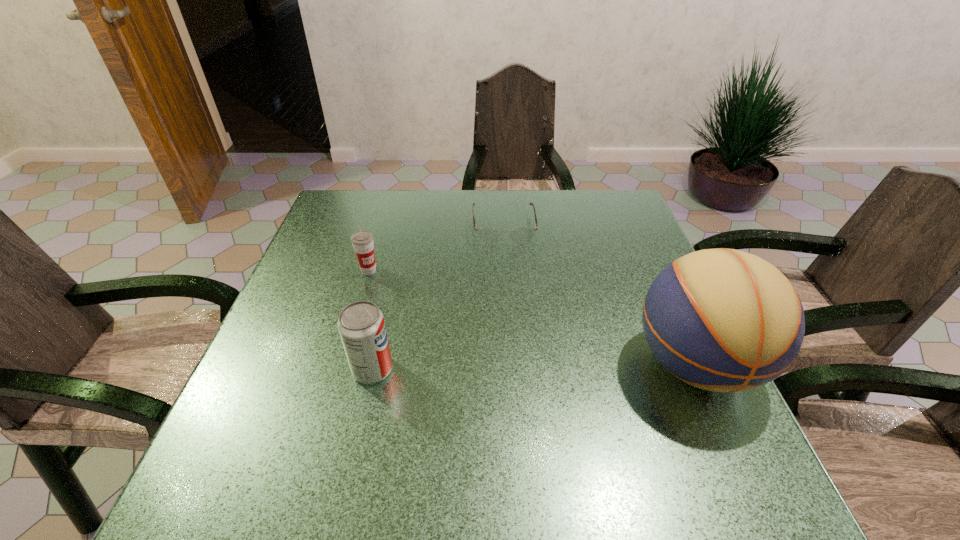
Where is `vacant space at the left edge of the desktop`? The image size is (960, 540). vacant space at the left edge of the desktop is located at coordinates (324, 269).

In the image, there is a desktop. Where is `vacant space at the right edge`? This screenshot has height=540, width=960. vacant space at the right edge is located at coordinates (624, 303).

In order to click on free space at the far left corner of the desktop in this screenshot , I will do `click(365, 226)`.

In the image, there is a desktop. Identify the location of vacant area at the near left corner. click(x=221, y=429).

Find the location of a particular element. The image size is (960, 540). blank space at the near right corner of the desktop is located at coordinates (667, 404).

Image resolution: width=960 pixels, height=540 pixels. In order to click on free space between the third nearest object and the farthest object in this screenshot , I will do `click(436, 249)`.

Locate an element on the screen. The image size is (960, 540). vacant area that lies between the basketball and the soda is located at coordinates (534, 367).

Locate an element on the screen. free point between the cup and the shortest object is located at coordinates (436, 249).

Locate an element on the screen. free space between the shortest object and the soda is located at coordinates (438, 298).

The height and width of the screenshot is (540, 960). In order to click on vacant space in between the third nearest object and the basketball in this screenshot , I will do `click(532, 318)`.